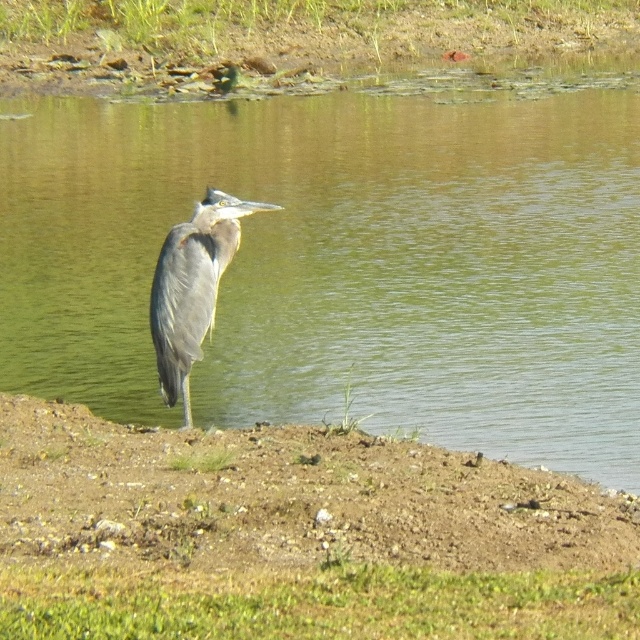
Can you confirm if greenish water at center is taller than dull brown dirt at lower center?

Correct, greenish water at center is much taller as dull brown dirt at lower center.

Which of these two, greenish water at center or dull brown dirt at lower center, stands taller?

greenish water at center is taller.

Locate an element on the screen. The height and width of the screenshot is (640, 640). greenish water at center is located at coordinates (349, 257).

Does point (83, 268) lie behind point (232, 202)?

Yes, it is behind point (232, 202).

Which is more to the left, greenish water at center or gray feathered heron at center?

From the viewer's perspective, greenish water at center appears more on the left side.

Is point (609, 372) in front of point (188, 305)?

No, (609, 372) is behind (188, 305).

The image size is (640, 640). In order to click on greenish water at center in this screenshot , I will do `click(349, 257)`.

Can you confirm if dull brown dirt at lower center is thinner than gray feathered heron at center?

In fact, dull brown dirt at lower center might be wider than gray feathered heron at center.

Which is in front, point (76, 484) or point (157, 346)?

Point (76, 484) is more forward.

This screenshot has width=640, height=640. Identify the location of dull brown dirt at lower center. (288, 499).